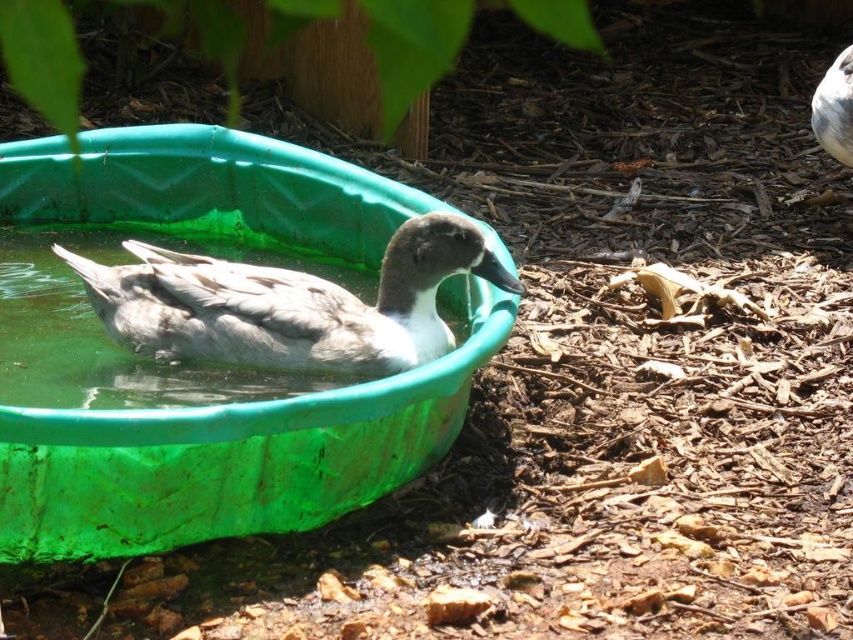
Question: Can you confirm if green plastic basin at center is positioned to the left of gray matte duck at center?

Choices:
 (A) yes
 (B) no

Answer: (A)

Question: Among these points, which one is farthest from the camera?

Choices:
 (A) (96, 305)
 (B) (109, 520)

Answer: (A)

Question: Can you confirm if green plastic basin at center is smaller than gray matte duck at center?

Choices:
 (A) no
 (B) yes

Answer: (A)

Question: Does green plastic basin at center appear on the right side of gray matte duck at center?

Choices:
 (A) no
 (B) yes

Answer: (A)